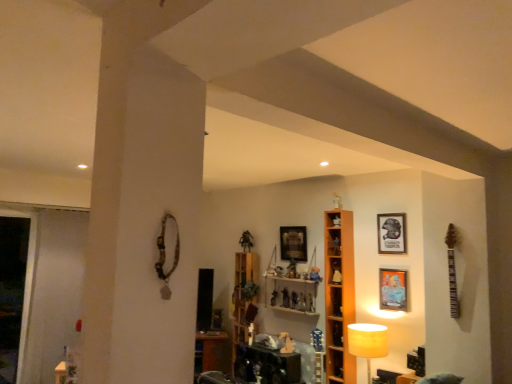
The height and width of the screenshot is (384, 512). I want to click on matte black picture frame at upper right, the 2th picture frame when ordered from front to back, so click(391, 233).

This screenshot has height=384, width=512. Find the location of `matte plastic action figure at center, marked as the second toy in a left-to-right arrangement`. matte plastic action figure at center, marked as the second toy in a left-to-right arrangement is located at coordinates (285, 298).

Describe the element at coordinates (294, 300) in the screenshot. The width and height of the screenshot is (512, 384). I see `matte plastic toy at center, which is the third toy in left-to-right order` at that location.

Measure the distance between matte plastic toy at center, acting as the second toy starting from the right, and camera.

They are 13.98 feet apart.

Locate an element on the screen. This screenshot has width=512, height=384. orange wood shelf at center, the 2th shelf in the back-to-front sequence is located at coordinates (339, 295).

This screenshot has width=512, height=384. What do you see at coordinates (339, 295) in the screenshot?
I see `orange wood shelf at center, marked as the second shelf in a left-to-right arrangement` at bounding box center [339, 295].

Describe the element at coordinates (14, 292) in the screenshot. I see `transparent glass door at left` at that location.

You are a GUI agent. You are given a task and a screenshot of the screen. Output one action in this format:
    pyautogui.click(x=<x>, y=<y>)
    Task: Click on the wooden picture frame at upper center, which appears as the third picture frame when viewed from the front
    The width and height of the screenshot is (512, 384).
    Given the screenshot: What is the action you would take?
    pyautogui.click(x=293, y=243)

At what (x,y) coordinates should I click in order to perform the action: click on matte black picture frame at upper right, which is counted as the 1th picture frame, starting from the right. Please return your answer as a coordinate pair (x, y). The height and width of the screenshot is (384, 512). Looking at the image, I should click on (391, 233).

Is wooden shelf at center, marked as the 1th shelf in a left-to-right arrangement, positioned with its back to white fabric lampshade at lower right?

No.

Is point (311, 293) less distant than point (364, 327)?

No.

Is wooden shelf at center, marked as the 1th shelf in a left-to-right arrangement, closer to camera compared to white fabric lampshade at lower right?

No, wooden shelf at center, marked as the 1th shelf in a left-to-right arrangement, is behind white fabric lampshade at lower right.

From a real-world perspective, is transparent glass door at left physically located above or below wooden shelf at center, marked as the 1th shelf in a left-to-right arrangement?

transparent glass door at left is situated lower than wooden shelf at center, marked as the 1th shelf in a left-to-right arrangement, in the real world.

Is transparent glass door at left situated inside wooden shelf at center, the 2th shelf in the front-to-back sequence, or outside?

The correct answer is: outside.

Considering the relative positions of transparent glass door at left and wooden shelf at center, marked as the 1th shelf in a left-to-right arrangement, in the image provided, is transparent glass door at left to the left or to the right of wooden shelf at center, marked as the 1th shelf in a left-to-right arrangement,?

transparent glass door at left is to the left of wooden shelf at center, marked as the 1th shelf in a left-to-right arrangement.

From their relative heights in the image, would you say transparent glass door at left is taller or shorter than wooden shelf at center, the 2th shelf in the front-to-back sequence?

transparent glass door at left is taller than wooden shelf at center, the 2th shelf in the front-to-back sequence.

Looking at their sizes, would you say metallic figurine at center, which is the 4th toy in right-to-left order, is wider or thinner than orange wood shelf at center, the 1th shelf viewed from the front?

Considering their sizes, metallic figurine at center, which is the 4th toy in right-to-left order, looks slimmer than orange wood shelf at center, the 1th shelf viewed from the front.

Locate an element on the screen. The width and height of the screenshot is (512, 384). the 4th toy behind the orange wood shelf at center, the first shelf positioned from the right is located at coordinates (274, 297).

From the image's perspective, between metallic figurine at center, which is the 4th toy in right-to-left order, and orange wood shelf at center, the first shelf positioned from the right, who is located below?

From the image's view, metallic figurine at center, which is the 4th toy in right-to-left order, is below.

Is matte orange picture frame at upper right, which is counted as the first picture frame, starting from the front, to the left or to the right of wooden shelf at center in the image?

From the image, it's evident that matte orange picture frame at upper right, which is counted as the first picture frame, starting from the front, is to the right of wooden shelf at center.

From a real-world perspective, count 1st picture frames upward from the wooden shelf at center and point to it. Please provide its 2D coordinates.

[(393, 289)]

Considering the positions of objects matte orange picture frame at upper right, which is the second picture frame in right-to-left order, and wooden shelf at center in the image provided, who is in front, matte orange picture frame at upper right, which is the second picture frame in right-to-left order, or wooden shelf at center?

Positioned in front is matte orange picture frame at upper right, which is the second picture frame in right-to-left order.

Locate an element on the screen. The height and width of the screenshot is (384, 512). glass door that appears below the wooden shelf at center, the 2th shelf in the right-to-left sequence (from the image's perspective) is located at coordinates (14, 292).

Based on the photo, can you confirm if wooden shelf at center, the 2th shelf in the right-to-left sequence, is wider than transparent glass door at left?

Correct, the width of wooden shelf at center, the 2th shelf in the right-to-left sequence, exceeds that of transparent glass door at left.

From the picture: Measure the distance from wooden shelf at center, the 2th shelf in the front-to-back sequence, to transparent glass door at left.

They are 3.38 meters apart.

How many degrees apart are the facing directions of wooden shelf at center, the 2th shelf in the right-to-left sequence, and transparent glass door at left?

There is a 90-degree angle between the facing directions of wooden shelf at center, the 2th shelf in the right-to-left sequence, and transparent glass door at left.

Can we say matte orange picture frame at upper right, which is the second picture frame in right-to-left order, lies outside matte plastic figurine at center, positioned as the 4th toy in left-to-right order?

Yes, matte orange picture frame at upper right, which is the second picture frame in right-to-left order, is outside of matte plastic figurine at center, positioned as the 4th toy in left-to-right order.

From a real-world perspective, which is physically below, matte orange picture frame at upper right, placed as the second picture frame when sorted from left to right, or matte plastic figurine at center, positioned as the 4th toy in left-to-right order?

matte plastic figurine at center, positioned as the 4th toy in left-to-right order, from a real-world perspective.

Based on the photo, is matte plastic toy at center, which is the third toy in left-to-right order, located outside metallic figurine at center, placed as the first toy when sorted from left to right?

Yes, matte plastic toy at center, which is the third toy in left-to-right order, is outside of metallic figurine at center, placed as the first toy when sorted from left to right.

Considering the sizes of objects matte plastic toy at center, acting as the second toy starting from the right, and metallic figurine at center, which is the 4th toy in right-to-left order, in the image provided, who is shorter, matte plastic toy at center, acting as the second toy starting from the right, or metallic figurine at center, which is the 4th toy in right-to-left order,?

metallic figurine at center, which is the 4th toy in right-to-left order, is shorter.

Is matte plastic toy at center, which is the third toy in left-to-right order, at the left side of metallic figurine at center, placed as the first toy when sorted from left to right?

No.

Is point (297, 299) in front of point (275, 300)?

Yes, point (297, 299) is closer to viewer.

You are a GUI agent. You are given a task and a screenshot of the screen. Output one action in this format:
    pyautogui.click(x=<x>, y=<y>)
    Task: Click on the table lamp that appears below the wooden shelf at center, marked as the 1th shelf in a left-to-right arrangement (from the image's perspective)
    
    Given the screenshot: What is the action you would take?
    pyautogui.click(x=367, y=342)

The height and width of the screenshot is (384, 512). I want to click on glass door behind the wooden shelf at center, marked as the 1th shelf in a left-to-right arrangement, so click(14, 292).

Considering their positions, is wooden shelf at center positioned further to wooden shelf at center, the 2th shelf in the right-to-left sequence, than metallic figurine at center, which is the 4th toy in right-to-left order?

The object further to wooden shelf at center, the 2th shelf in the right-to-left sequence, is wooden shelf at center.

Looking at the image, which one is located closer to wooden shelf at center, orange wood shelf at center, the first shelf positioned from the right, or wooden shelf at center, the first shelf from the back?

The object closer to wooden shelf at center is wooden shelf at center, the first shelf from the back.

When comparing their distances from matte orange picture frame at upper right, placed as the second picture frame when sorted from left to right, does matte plastic action figure at center, marked as the second toy in a left-to-right arrangement, or wooden picture frame at upper center, acting as the 3th picture frame starting from the right, seem further?

matte plastic action figure at center, marked as the second toy in a left-to-right arrangement, is positioned further to the anchor matte orange picture frame at upper right, placed as the second picture frame when sorted from left to right.

Looking at the image, which one is located further to matte plastic action figure at center, marked as the second toy in a left-to-right arrangement, matte plastic toy at center, acting as the second toy starting from the right, or matte plastic figurine at center, the 1th toy in the right-to-left sequence?

matte plastic figurine at center, the 1th toy in the right-to-left sequence, is further to matte plastic action figure at center, marked as the second toy in a left-to-right arrangement.

Based on their spatial positions, is matte orange picture frame at upper right, arranged as the third picture frame when viewed from the back, or orange wood shelf at center, marked as the second shelf in a left-to-right arrangement, further from wooden shelf at center?

matte orange picture frame at upper right, arranged as the third picture frame when viewed from the back, is further to wooden shelf at center.

Looking at the image, which one is located closer to orange wood shelf at center, the first shelf positioned from the right, wooden picture frame at upper center, acting as the 3th picture frame starting from the right, or matte black picture frame at upper right, which is counted as the 1th picture frame, starting from the right?

Among the two, matte black picture frame at upper right, which is counted as the 1th picture frame, starting from the right, is located nearer to orange wood shelf at center, the first shelf positioned from the right.

Considering their positions, is wooden shelf at center positioned closer to matte orange picture frame at upper right, arranged as the third picture frame when viewed from the back, than matte plastic action figure at center, arranged as the third toy when viewed from the right?

matte plastic action figure at center, arranged as the third toy when viewed from the right, lies closer to matte orange picture frame at upper right, arranged as the third picture frame when viewed from the back, than the other object.

Based on their spatial positions, is metallic figurine at center, which is the 4th toy in right-to-left order, or wooden shelf at center closer to transparent glass door at left?

Based on the image, wooden shelf at center appears to be nearer to transparent glass door at left.

The image size is (512, 384). Find the location of `shelf between orange wood shelf at center, the first shelf positioned from the right, and wooden picture frame at upper center, the first picture frame from the back, in the front-back direction`. shelf between orange wood shelf at center, the first shelf positioned from the right, and wooden picture frame at upper center, the first picture frame from the back, in the front-back direction is located at coordinates (291, 294).

The width and height of the screenshot is (512, 384). I want to click on cabinet between transparent glass door at left and orange wood shelf at center, marked as the second shelf in a left-to-right arrangement, so click(244, 297).

At what (x,y) coordinates should I click in order to perform the action: click on toy between matte plastic toy at center, which is the third toy in left-to-right order, and matte black picture frame at upper right, the 2th picture frame when ordered from front to back, in the horizontal direction. Please return your answer as a coordinate pair (x, y). The height and width of the screenshot is (384, 512). Looking at the image, I should click on (301, 302).

The width and height of the screenshot is (512, 384). I want to click on shelf between orange wood shelf at center, the 1th shelf viewed from the front, and wooden shelf at center, along the z-axis, so click(291, 294).